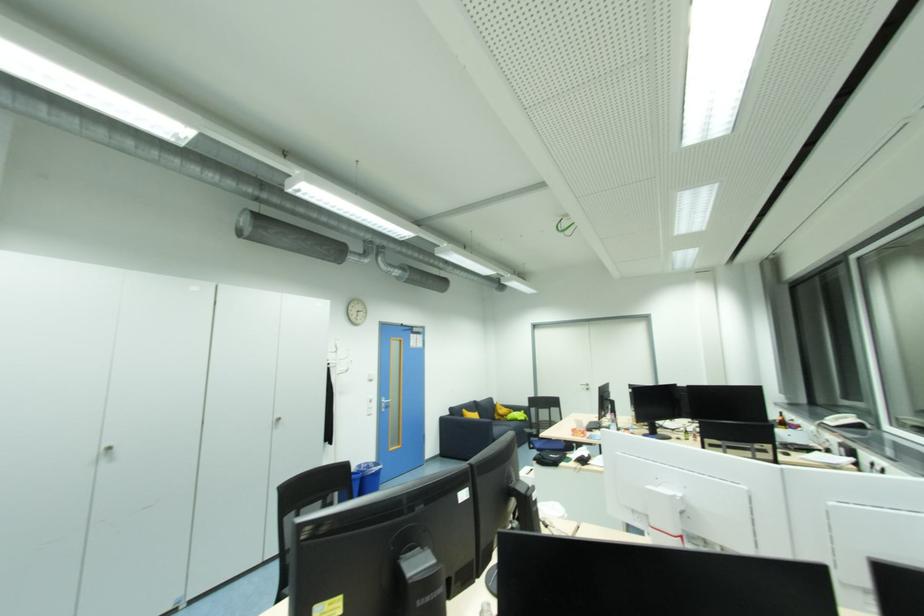
Find where to sit the dark sofa seat. Please return your answer as a coordinate pair (x, y).

(502, 424)